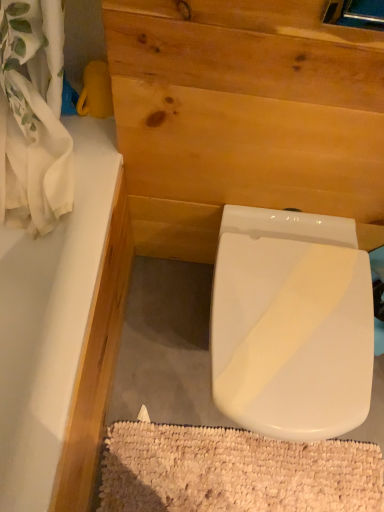
Question: Based on their positions, is white glossy bathtub at upper left located to the left or right of natural wood plywood at center?

Choices:
 (A) right
 (B) left

Answer: (B)

Question: From the image's perspective, is white glossy bathtub at upper left above or below natural wood plywood at center?

Choices:
 (A) below
 (B) above

Answer: (A)

Question: Based on their relative distances, which object is nearer to the white glossy bathtub at upper left?

Choices:
 (A) white textured bath mat at lower center
 (B) natural wood plywood at center
 (C) white glossy toilet at center

Answer: (B)

Question: Which object is positioned closest to the white glossy toilet at center?

Choices:
 (A) white textured bath mat at lower center
 (B) natural wood plywood at center
 (C) white glossy bathtub at upper left

Answer: (B)